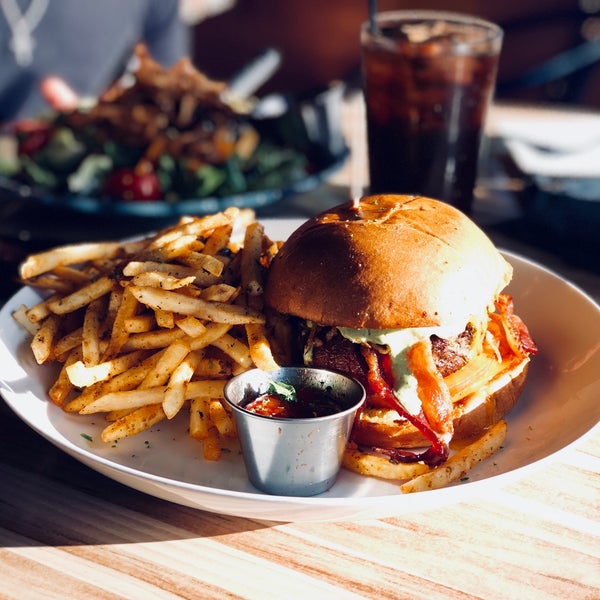
This screenshot has height=600, width=600. I want to click on wooden tabletop, so click(312, 586).